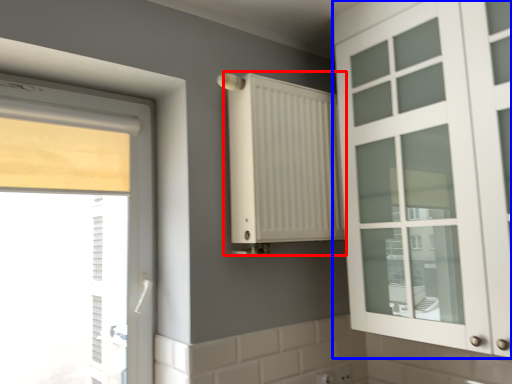
Question: Which object appears closest to the camera in this image, radiator (highlighted by a red box) or cabinetry (highlighted by a blue box)?

Choices:
 (A) radiator
 (B) cabinetry

Answer: (B)